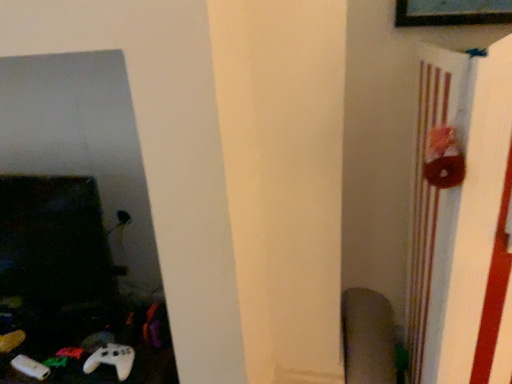
Where is `free point to the left of white matte game controller at lower left`? Image resolution: width=512 pixels, height=384 pixels. free point to the left of white matte game controller at lower left is located at coordinates (66, 366).